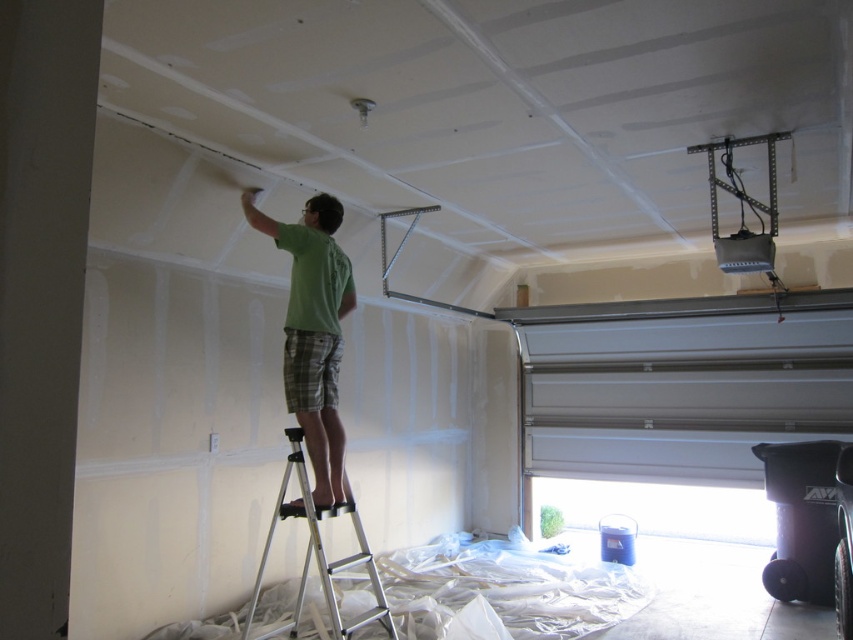
Question: Which point appears closest to the camera in this image?

Choices:
 (A) (369, 561)
 (B) (326, 246)
 (C) (842, 372)

Answer: (A)

Question: Is silver metallic garage door at lower right below green cotton shirt at upper center?

Choices:
 (A) no
 (B) yes

Answer: (B)

Question: Among these objects, which one is farthest from the camera?

Choices:
 (A) green cotton shirt at upper center
 (B) silver metallic ladder at center
 (C) silver metallic garage door at lower right

Answer: (C)

Question: Which of these objects is positioned farthest from the silver metallic ladder at center?

Choices:
 (A) green cotton shirt at upper center
 (B) silver metallic garage door at lower right

Answer: (B)

Question: Is green cotton shirt at upper center below silver metallic ladder at center?

Choices:
 (A) yes
 (B) no

Answer: (B)

Question: Does silver metallic garage door at lower right come behind silver metallic ladder at center?

Choices:
 (A) no
 (B) yes

Answer: (B)